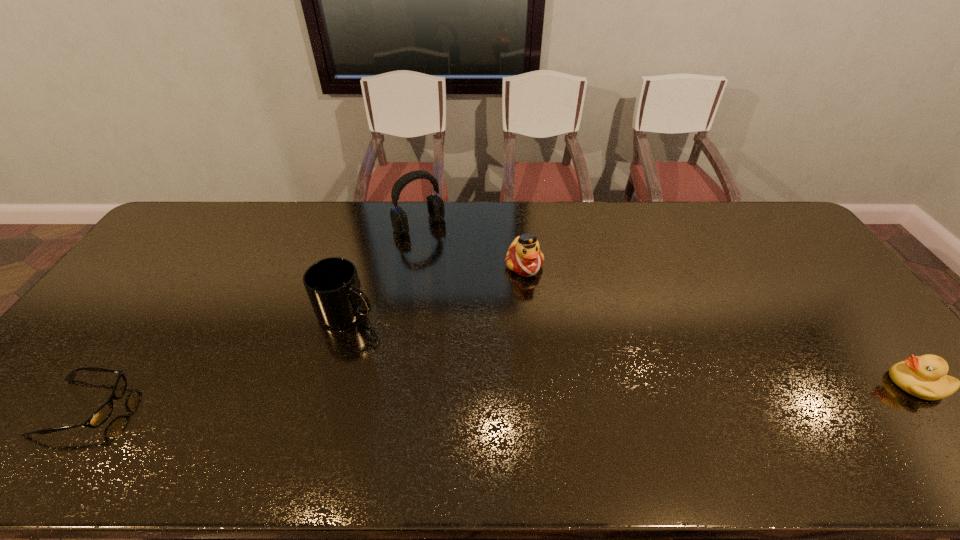
This screenshot has height=540, width=960. Find the location of `empty space between the duck and the mug`. empty space between the duck and the mug is located at coordinates (436, 288).

Identify the location of blank region between the fourth tallest object and the third nearest object. (632, 347).

Find the location of a particular element. Image resolution: width=960 pixels, height=540 pixels. free point between the third farthest object and the second object from right to left is located at coordinates (436, 288).

This screenshot has height=540, width=960. I want to click on free area in between the tallest object and the duckling, so click(x=667, y=304).

The height and width of the screenshot is (540, 960). Identify the location of free area in between the headset and the fourth nearest object. (471, 245).

Where is `object that can be found as the third closest to the duck`? The image size is (960, 540). object that can be found as the third closest to the duck is located at coordinates (924, 376).

Where is `object identified as the second closest to the tallest object`? The height and width of the screenshot is (540, 960). object identified as the second closest to the tallest object is located at coordinates (334, 289).

Locate an element on the screen. The image size is (960, 540). vacant position in the image that satisfies the following two spatial constraints: 1. on the front side of the tallest object; 2. on the left side of the duck is located at coordinates (413, 265).

Locate an element on the screen. The width and height of the screenshot is (960, 540). vacant space that satisfies the following two spatial constraints: 1. on the back side of the tallest object; 2. on the right side of the third nearest object is located at coordinates (372, 224).

In order to click on free point that satisfies the following two spatial constraints: 1. on the front side of the tallest object; 2. on the front-facing side of the fourth tallest object in this screenshot , I will do `click(394, 383)`.